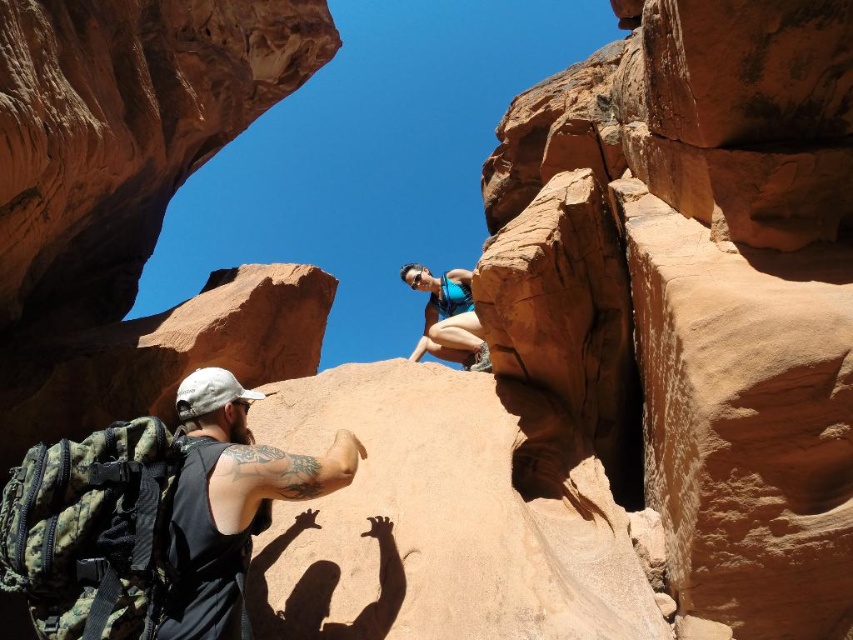
Question: Can you confirm if camouflage backpack at lower left is bigger than matte blue tank top at upper center?

Choices:
 (A) no
 (B) yes

Answer: (A)

Question: Can you confirm if camouflage backpack at lower left is positioned below matte blue tank top at upper center?

Choices:
 (A) yes
 (B) no

Answer: (A)

Question: Which point is closer to the camera?

Choices:
 (A) (831, 518)
 (B) (442, 337)
 (C) (344, 484)

Answer: (A)

Question: Can you confirm if smooth sandstone rock at upper center is thinner than matte blue tank top at upper center?

Choices:
 (A) no
 (B) yes

Answer: (A)

Question: Which of these objects is positioned closest to the camouflage backpack at lower left?

Choices:
 (A) smooth sandstone rock at upper center
 (B) matte blue tank top at upper center

Answer: (B)

Question: Which object appears closest to the camera in this image?

Choices:
 (A) smooth sandstone rock at upper center
 (B) matte blue tank top at upper center

Answer: (A)